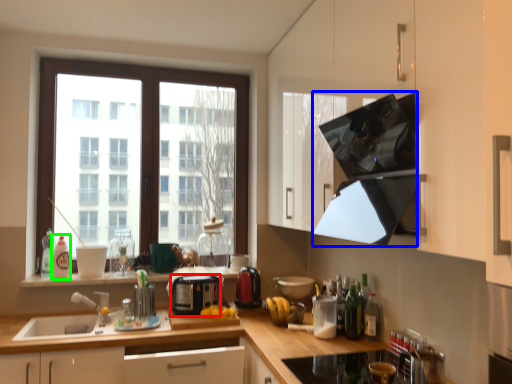
Question: Based on their relative distances, which object is farther from appliance (highlighted by a red box)? Choose from exhaust hood (highlighted by a blue box) and bottle (highlighted by a green box).

Choices:
 (A) exhaust hood
 (B) bottle

Answer: (A)